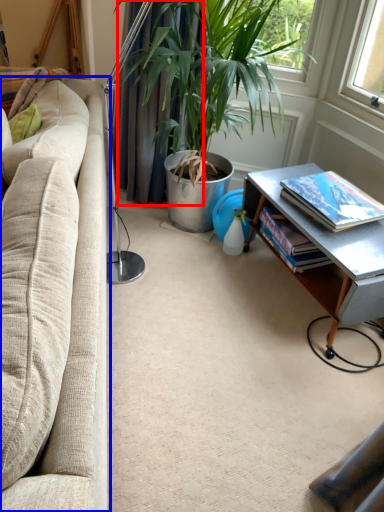
Question: Among these objects, which one is nearest to the camera, curtain (highlighted by a red box) or studio couch (highlighted by a blue box)?

Choices:
 (A) curtain
 (B) studio couch

Answer: (B)